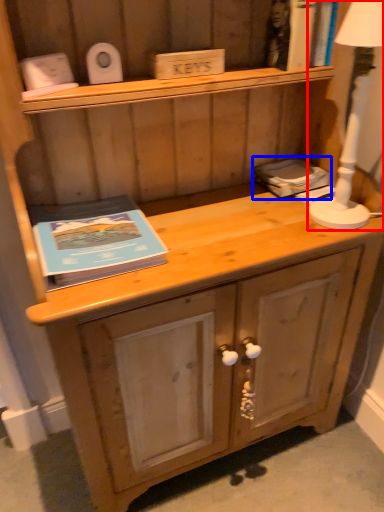
Question: Which object appears closest to the camera in this image, bedside lamp (highlighted by a red box) or book (highlighted by a blue box)?

Choices:
 (A) bedside lamp
 (B) book

Answer: (A)